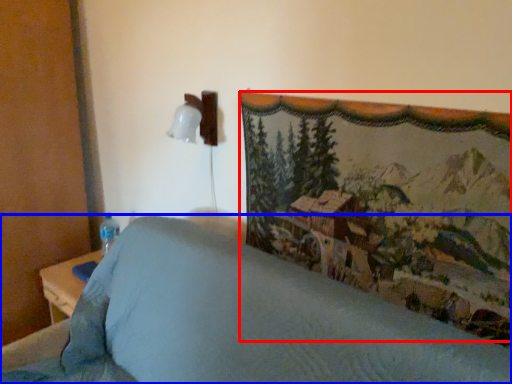
Question: Which point is closer to the camera, mountain landscape (highlighted by a red box) or furniture (highlighted by a blue box)?

Choices:
 (A) mountain landscape
 (B) furniture

Answer: (B)